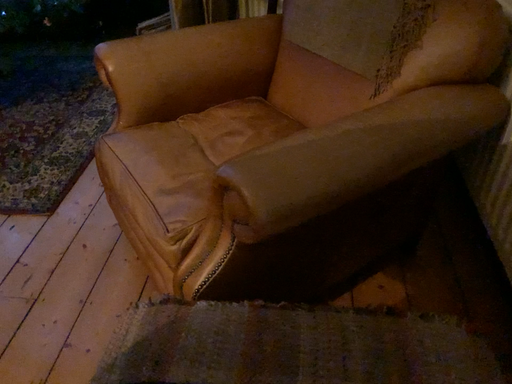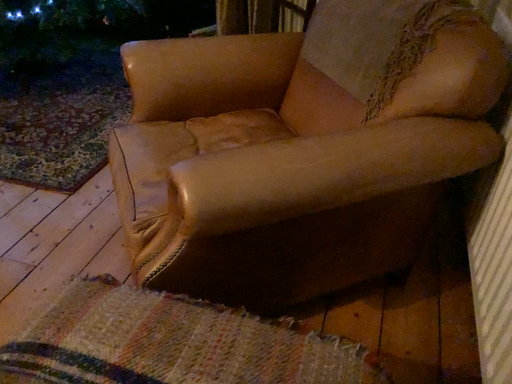
Question: Which way did the camera rotate in the video?

Choices:
 (A) rotated left
 (B) rotated right

Answer: (A)